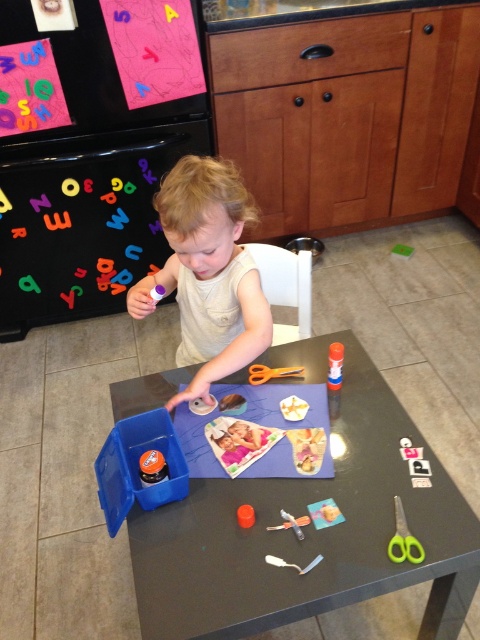
Which is in front, point (227, 308) or point (276, 564)?

Positioned in front is point (276, 564).

Who is taller, smooth beige shirt at center or white plastic spoon at center?

Standing taller between the two is smooth beige shirt at center.

Where is `smooth beige shirt at center`? smooth beige shirt at center is located at coordinates (207, 273).

Where is `smooth beige shirt at center`? The height and width of the screenshot is (640, 480). smooth beige shirt at center is located at coordinates (207, 273).

Between metallic silver scissors at center and white plastic spoon at center, which one has less height?

white plastic spoon at center

Which is in front, point (301, 525) or point (312, 563)?

Positioned in front is point (312, 563).

The width and height of the screenshot is (480, 640). What do you see at coordinates (291, 524) in the screenshot? I see `metallic silver scissors at center` at bounding box center [291, 524].

The height and width of the screenshot is (640, 480). In order to click on metallic silver scissors at center in this screenshot , I will do `click(291, 524)`.

Can you confirm if matte plastic table at center is wider than white plastic spoon at center?

Yes.

Who is positioned more to the right, matte plastic table at center or white plastic spoon at center?

Positioned to the right is white plastic spoon at center.

Is point (199, 506) positioned after point (286, 564)?

Yes, it is behind point (286, 564).

Image resolution: width=480 pixels, height=640 pixels. Find the location of `matte plastic table at center`. matte plastic table at center is located at coordinates (309, 529).